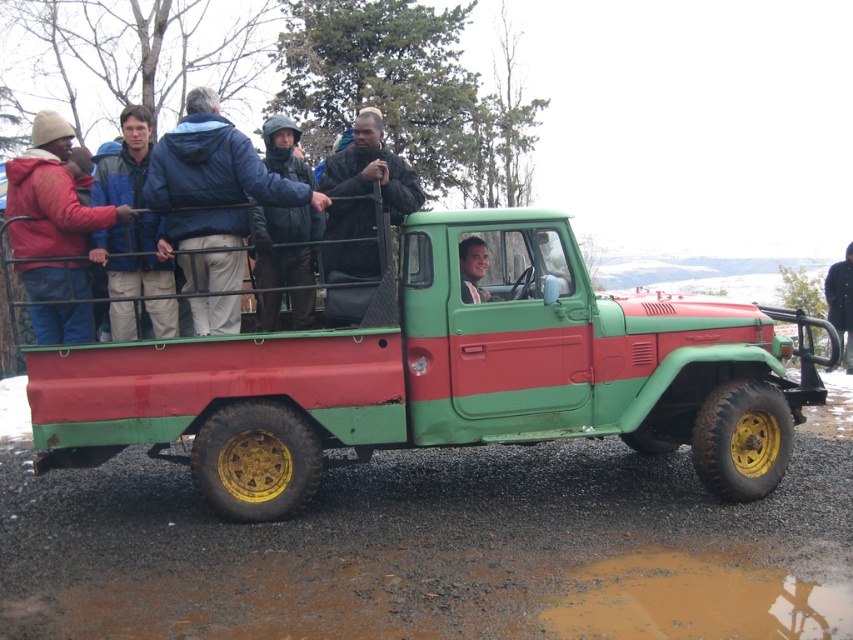
Question: Estimate the real-world distances between objects in this image. Which object is farther from the green matte truck at center?

Choices:
 (A) blue jacket at center
 (B) dark brown leather jacket at center
 (C) blue fleece jacket at left
 (D) black fabric jacket at upper center

Answer: (D)

Question: Which is nearer to the blue fleece jacket at left?

Choices:
 (A) green matte truck at center
 (B) dark brown leather jacket at center

Answer: (B)

Question: Which is nearer to the blue fleece jacket at left?

Choices:
 (A) blue jacket at center
 (B) dark brown leather jacket at center

Answer: (A)

Question: Can you confirm if green matte truck at center is positioned above blue jacket at center?

Choices:
 (A) no
 (B) yes

Answer: (A)

Question: Is blue jacket at center smaller than dark brown leather jacket at center?

Choices:
 (A) yes
 (B) no

Answer: (B)

Question: Is green matte truck at center above blue fleece jacket at left?

Choices:
 (A) yes
 (B) no

Answer: (B)